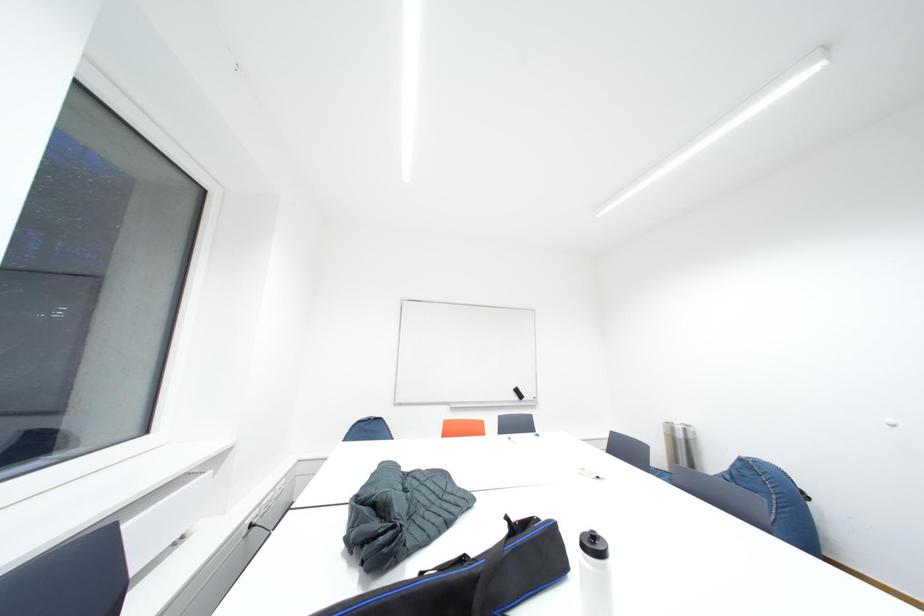
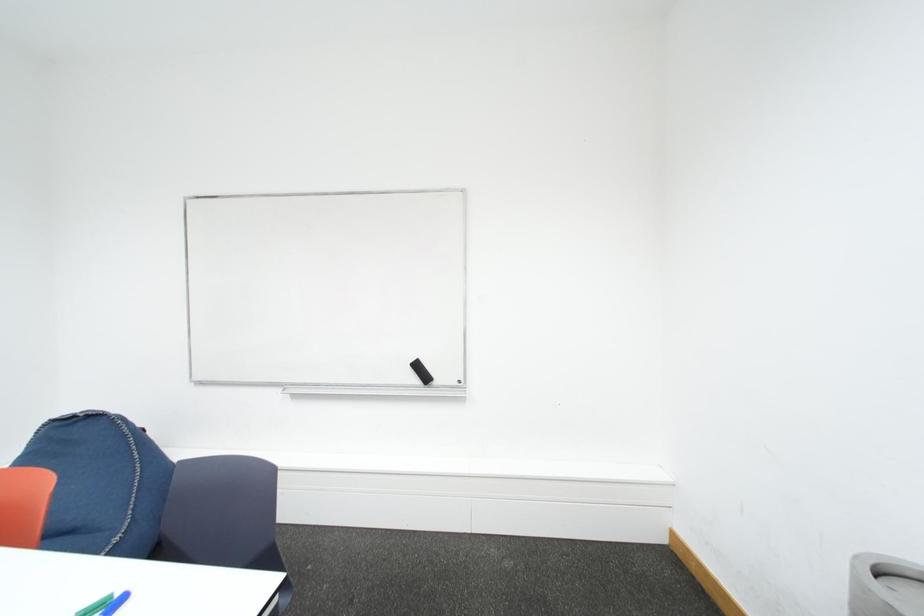
In a continuous first-person perspective shot, in which direction is the camera moving?

The movement direction of the cameraman is right, forward.